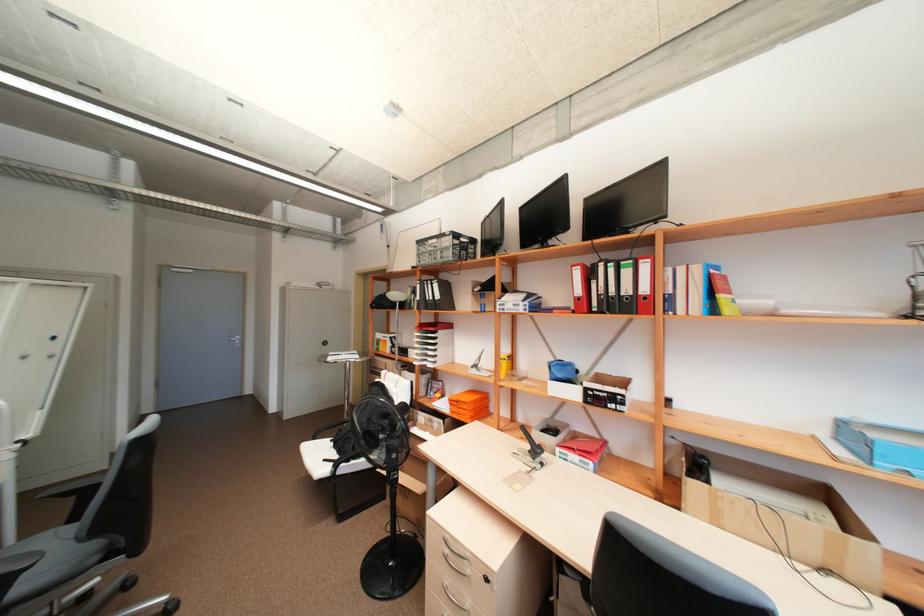
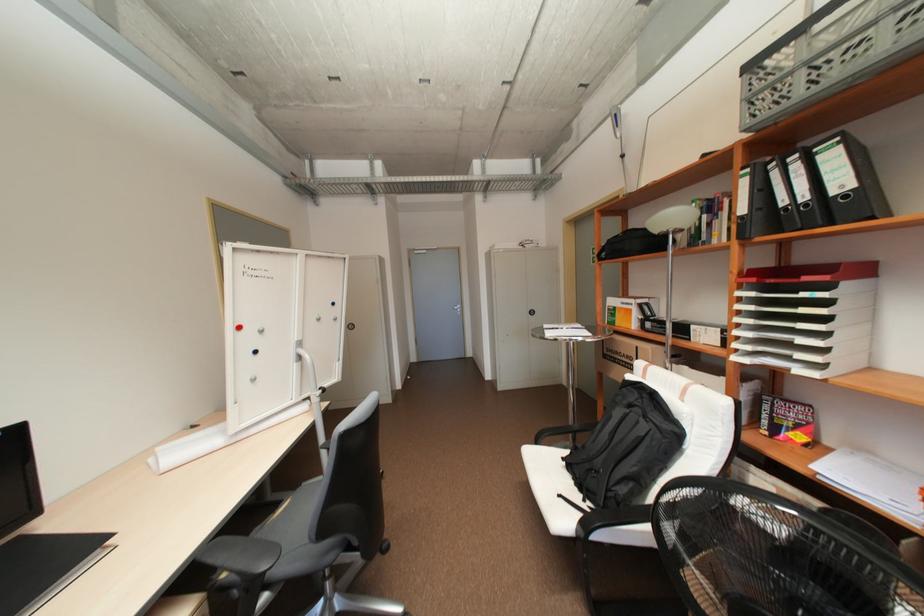
Where in the second image is the point corresponding to point 378,371 from the first image?

(611, 355)